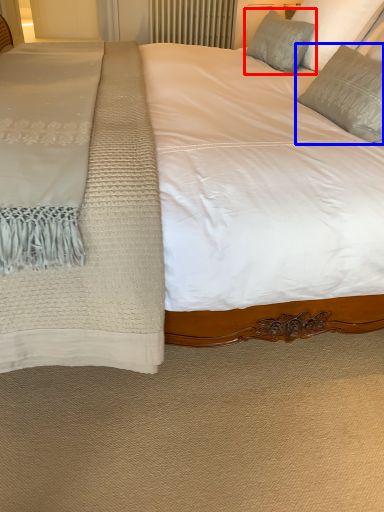
Question: Which point is closer to the camera, pillow (highlighted by a red box) or pillow (highlighted by a blue box)?

Choices:
 (A) pillow
 (B) pillow

Answer: (B)